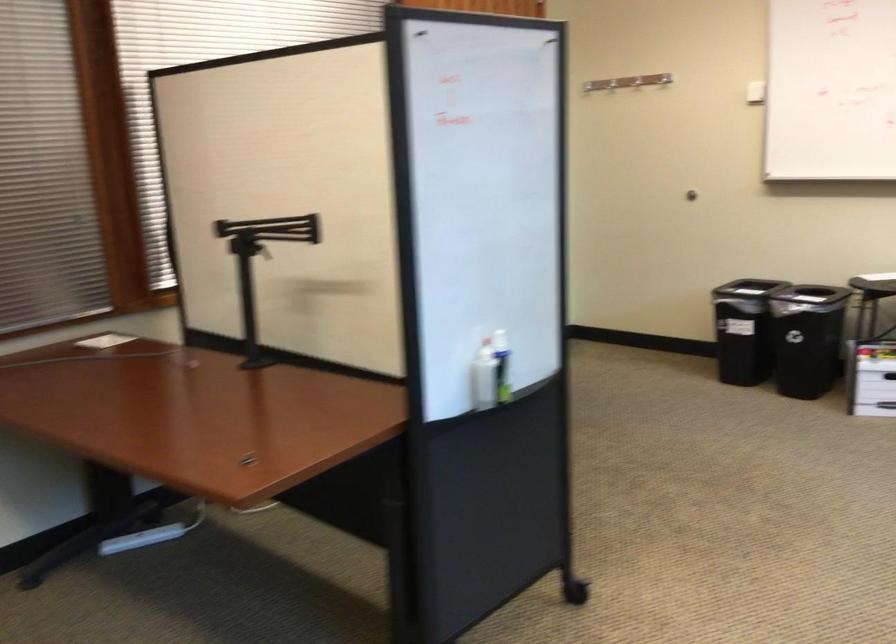
The image size is (896, 644). What do you see at coordinates (483, 377) in the screenshot? I see `the white spray bottle` at bounding box center [483, 377].